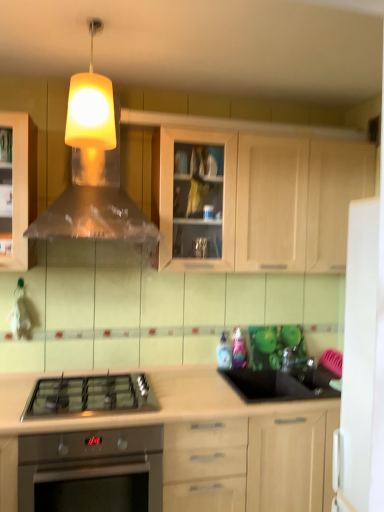
The height and width of the screenshot is (512, 384). Describe the element at coordinates (295, 361) in the screenshot. I see `satin nickel faucet at right` at that location.

Identify the location of satin black gas stove at center. (90, 396).

How different are the orientations of satin nickel faucet at right and stainless steel oven at lower left in degrees?

The facing directions of satin nickel faucet at right and stainless steel oven at lower left are 0.552 degrees apart.

From the image's perspective, is satin nickel faucet at right above stainless steel oven at lower left?

Correct, satin nickel faucet at right appears higher than stainless steel oven at lower left in the image.

Is satin nickel faucet at right inside or outside of stainless steel oven at lower left?

satin nickel faucet at right exists outside the volume of stainless steel oven at lower left.

Between satin nickel faucet at right and stainless steel oven at lower left, which one appears on the right side from the viewer's perspective?

satin nickel faucet at right.

Is metallic silver vent at upper center to the right of satin black gas stove at center from the viewer's perspective?

Yes.

Is metallic silver vent at upper center closer to the viewer compared to satin black gas stove at center?

That is False.

Is metallic silver vent at upper center thinner than satin black gas stove at center?

Yes, metallic silver vent at upper center is thinner than satin black gas stove at center.

The width and height of the screenshot is (384, 512). In order to click on vent that is above the satin black gas stove at center (from the image's perspective) in this screenshot , I will do `click(94, 170)`.

From a real-world perspective, is light wood cabinet at center, which is the first cabinetry from bottom to top, under metallic silver vent at upper center?

Yes, from a real-world perspective, light wood cabinet at center, which is the first cabinetry from bottom to top, is beneath metallic silver vent at upper center.

Looking at this image, does light wood cabinet at center, which is the first cabinetry from bottom to top, lie in front of metallic silver vent at upper center?

Yes, it is in front of metallic silver vent at upper center.

Considering the positions of points (236, 421) and (90, 149), is point (236, 421) farther from camera compared to point (90, 149)?

Yes, it is.

Which of these two, light wood cabinet at center, acting as the second cabinetry starting from the top, or metallic silver vent at upper center, is smaller?

Result: metallic silver vent at upper center is smaller.

Is yellow matte lampshade at upper center far from light wood cabinet at center, acting as the second cabinetry starting from the top?

yellow matte lampshade at upper center is positioned a significant distance from light wood cabinet at center, acting as the second cabinetry starting from the top.

Where is `the 2nd cabinetry located beneath the yellow matte lampshade at upper center (from a real-world perspective)`? The image size is (384, 512). the 2nd cabinetry located beneath the yellow matte lampshade at upper center (from a real-world perspective) is located at coordinates (x=205, y=442).

Is yellow matte lampshade at upper center to the right of light wood cabinet at center, which is the first cabinetry from bottom to top, from the viewer's perspective?

Incorrect, yellow matte lampshade at upper center is not on the right side of light wood cabinet at center, which is the first cabinetry from bottom to top.

Which is more to the right, yellow matte lampshade at upper center or satin black gas stove at center?

yellow matte lampshade at upper center.

Is yellow matte lampshade at upper center oriented away from satin black gas stove at center?

No, satin black gas stove at center is not at the back of yellow matte lampshade at upper center.

Does yellow matte lampshade at upper center have a smaller size compared to satin black gas stove at center?

Correct, yellow matte lampshade at upper center occupies less space than satin black gas stove at center.

How much distance is there between yellow matte lampshade at upper center and satin black gas stove at center?

yellow matte lampshade at upper center and satin black gas stove at center are 3.67 feet apart from each other.

Which is in front, stainless steel oven at lower left or light wood cabinet at center, acting as the second cabinetry starting from the top?

light wood cabinet at center, acting as the second cabinetry starting from the top, is more forward.

From the picture: Can we say stainless steel oven at lower left lies outside light wood cabinet at center, acting as the second cabinetry starting from the top?

No, stainless steel oven at lower left is inside light wood cabinet at center, acting as the second cabinetry starting from the top,'s boundary.

Considering the relative sizes of stainless steel oven at lower left and light wood cabinet at center, which is the first cabinetry from bottom to top, in the image provided, is stainless steel oven at lower left wider than light wood cabinet at center, which is the first cabinetry from bottom to top,?

Yes.

Which is farther, (62, 507) or (196, 447)?

The point (196, 447) is farther.

Considering the sizes of objects light wood cabinet at upper center, which is counted as the 1th cabinetry, starting from the top, and satin nickel faucet at right in the image provided, who is smaller, light wood cabinet at upper center, which is counted as the 1th cabinetry, starting from the top, or satin nickel faucet at right?

Smaller between the two is satin nickel faucet at right.

Is light wood cabinet at upper center, which is counted as the 1th cabinetry, starting from the top, located outside satin nickel faucet at right?

Yes, light wood cabinet at upper center, which is counted as the 1th cabinetry, starting from the top, is located beyond the bounds of satin nickel faucet at right.

How distant is light wood cabinet at upper center, marked as the 2th cabinetry in a bottom-to-top arrangement, from satin nickel faucet at right?

light wood cabinet at upper center, marked as the 2th cabinetry in a bottom-to-top arrangement, is 91.40 centimeters away from satin nickel faucet at right.

Looking at this image, which point is more forward, (286, 215) or (305, 356)?

The point (286, 215) is closer to the camera.

Locate an element on the screen. This screenshot has height=512, width=384. faucet above the stainless steel oven at lower left (from the image's perspective) is located at coordinates (295, 361).

There is a satin black gas stove at center. Where is `vent above it (from a real-world perspective)`? vent above it (from a real-world perspective) is located at coordinates (94, 170).

Which object lies further to the anchor point metallic silver vent at upper center, yellow matte lampshade at upper center or satin black gas stove at center?

satin black gas stove at center is further to metallic silver vent at upper center.

Based on their spatial positions, is stainless steel oven at lower left or satin nickel faucet at right closer to satin black gas stove at center?

stainless steel oven at lower left is positioned closer to the anchor satin black gas stove at center.

From the picture: When comparing their distances from stainless steel oven at lower left, does metallic silver vent at upper center or satin nickel faucet at right seem closer?

metallic silver vent at upper center.

Looking at the image, which one is located further to yellow matte lampshade at upper center, metallic silver vent at upper center or light wood cabinet at center, which is the first cabinetry from bottom to top?

light wood cabinet at center, which is the first cabinetry from bottom to top.

Estimate the real-world distances between objects in this image. Which object is further from stainless steel oven at lower left, light wood cabinet at upper center, which is counted as the 1th cabinetry, starting from the top, or light wood cabinet at center, acting as the second cabinetry starting from the top?

The object further to stainless steel oven at lower left is light wood cabinet at upper center, which is counted as the 1th cabinetry, starting from the top.

Based on their spatial positions, is satin nickel faucet at right or light wood cabinet at upper center, marked as the 2th cabinetry in a bottom-to-top arrangement, closer to metallic silver vent at upper center?

The object closer to metallic silver vent at upper center is light wood cabinet at upper center, marked as the 2th cabinetry in a bottom-to-top arrangement.

In the scene shown: Considering their positions, is satin nickel faucet at right positioned further to yellow matte lampshade at upper center than light wood cabinet at upper center, which is counted as the 1th cabinetry, starting from the top?

satin nickel faucet at right is positioned further to the anchor yellow matte lampshade at upper center.

From the image, which object appears to be nearer to satin black gas stove at center, yellow matte lampshade at upper center or light wood cabinet at upper center, marked as the 2th cabinetry in a bottom-to-top arrangement?

light wood cabinet at upper center, marked as the 2th cabinetry in a bottom-to-top arrangement, lies closer to satin black gas stove at center than the other object.

I want to click on faucet between yellow matte lampshade at upper center and satin black gas stove at center vertically, so click(x=295, y=361).

Find the location of a particular element. light fixture situated between metallic silver vent at upper center and light wood cabinet at upper center, marked as the 2th cabinetry in a bottom-to-top arrangement, from left to right is located at coordinates (91, 106).

Image resolution: width=384 pixels, height=512 pixels. I want to click on gas stove between light wood cabinet at upper center, marked as the 2th cabinetry in a bottom-to-top arrangement, and light wood cabinet at center, acting as the second cabinetry starting from the top, in the vertical direction, so click(90, 396).

Identify the location of faucet between yellow matte lampshade at upper center and stainless steel oven at lower left vertically. (295, 361).